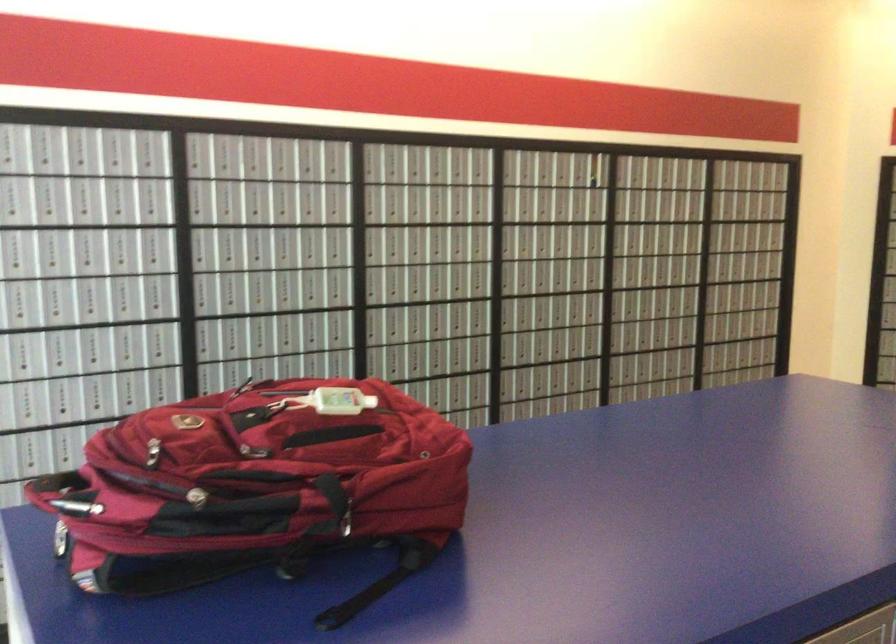
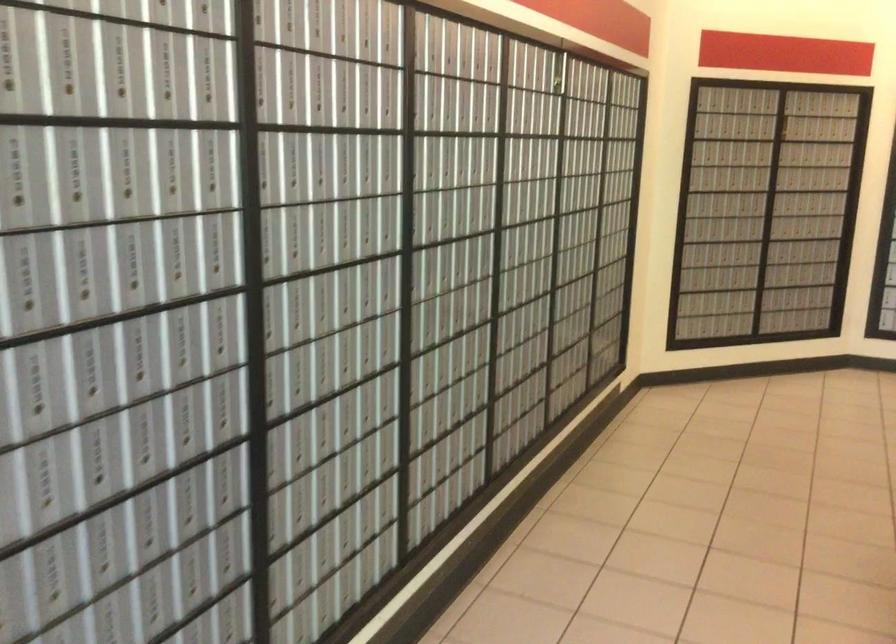
In the second image, find the point that corresponds to [266,301] in the first image.

(329, 252)